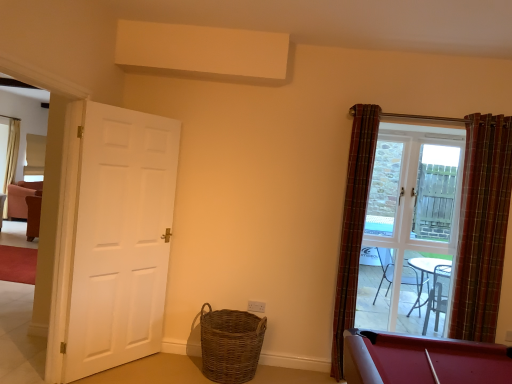
Question: From a real-world perspective, is plaid fabric curtain at right, which is counted as the first curtain, starting from the left, on top of clear glass door at right?

Choices:
 (A) yes
 (B) no

Answer: (B)

Question: Is plaid fabric curtain at right, the second curtain viewed from the right, facing towards clear glass door at right?

Choices:
 (A) no
 (B) yes

Answer: (A)

Question: Can you confirm if plaid fabric curtain at right, the second curtain viewed from the right, is positioned to the left of clear glass door at right?

Choices:
 (A) yes
 (B) no

Answer: (A)

Question: Does plaid fabric curtain at right, the second curtain viewed from the right, appear on the right side of clear glass door at right?

Choices:
 (A) no
 (B) yes

Answer: (A)

Question: Can you confirm if plaid fabric curtain at right, the second curtain viewed from the right, is smaller than clear glass door at right?

Choices:
 (A) yes
 (B) no

Answer: (B)

Question: Can you confirm if plaid fabric curtain at right, which is counted as the first curtain, starting from the left, is shorter than clear glass door at right?

Choices:
 (A) yes
 (B) no

Answer: (B)

Question: From the image's perspective, is plaid fabric curtain at right, placed as the 2th curtain when sorted from left to right, below woven brown basket at lower center?

Choices:
 (A) yes
 (B) no

Answer: (B)

Question: Can you confirm if plaid fabric curtain at right, placed as the 2th curtain when sorted from left to right, is smaller than woven brown basket at lower center?

Choices:
 (A) no
 (B) yes

Answer: (A)

Question: Is plaid fabric curtain at right, placed as the 2th curtain when sorted from left to right, bigger than woven brown basket at lower center?

Choices:
 (A) no
 (B) yes

Answer: (B)

Question: Is woven brown basket at lower center at the back of plaid fabric curtain at right, placed as the 2th curtain when sorted from left to right?

Choices:
 (A) no
 (B) yes

Answer: (A)

Question: Is the position of plaid fabric curtain at right, placed as the 2th curtain when sorted from left to right, less distant than that of woven brown basket at lower center?

Choices:
 (A) no
 (B) yes

Answer: (A)

Question: From a real-world perspective, is plaid fabric curtain at right, which is counted as the first curtain, starting from the right, on woven brown basket at lower center?

Choices:
 (A) yes
 (B) no

Answer: (A)

Question: Is plaid fabric curtain at right, placed as the 2th curtain when sorted from left to right, outside plaid fabric curtain at right, the second curtain viewed from the right?

Choices:
 (A) yes
 (B) no

Answer: (A)